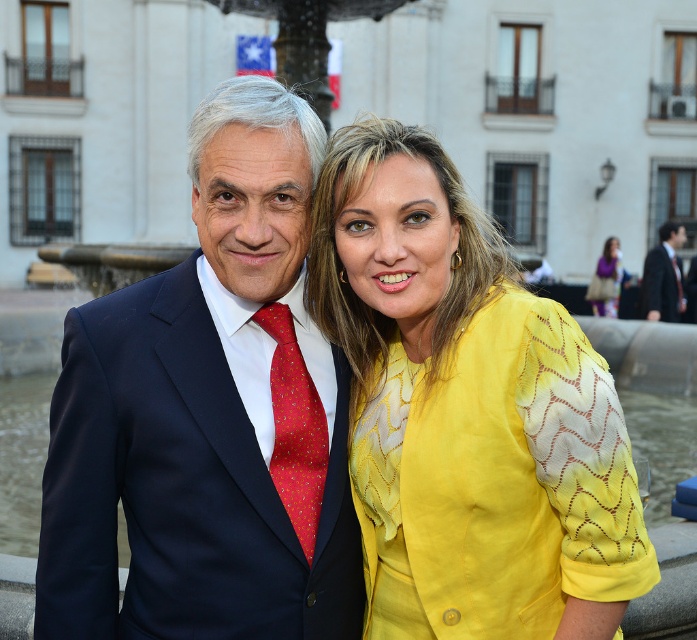
You are at the event and want to take a photo of both people. You notice two points marked in the image. The first point is at coordinates point (447, 564) and the second is at point (293, 452). Which point is closer to you?

Point (447, 564) is closer to the viewer than point (293, 452).

You are a photographer positioned at the camera. You want to capture a closeup shot of the yellow textured blouse at center. Given that your camera can focus on objects within 20 meters, will you be able to take the photo clearly?

The yellow textured blouse at center is 23.58 meters away from the camera, which is beyond the camera focus range of 20 meters. Therefore, you won not be able to take a clear closeup shot.